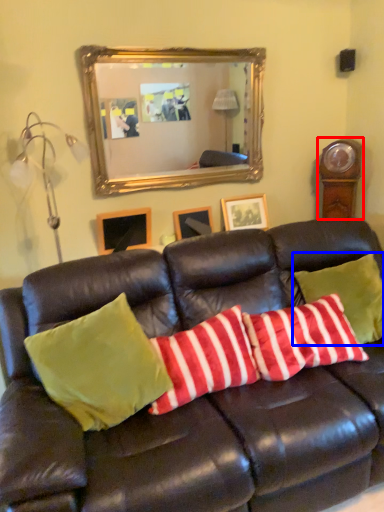
Question: Which object appears closest to the camera in this image, clock (highlighted by a red box) or pillow (highlighted by a blue box)?

Choices:
 (A) clock
 (B) pillow

Answer: (B)